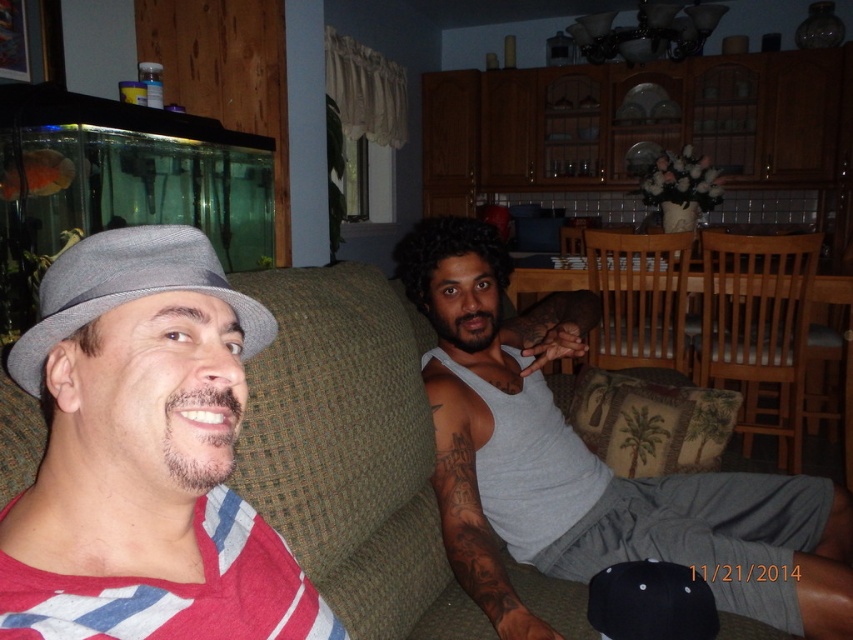
You are standing in the living room and want to place a small potted plant between the two points marked as point (x=115, y=317) and point (x=22, y=188). According to the scene, which point should the plant be closer to in order to be positioned in front of both?

The plant should be closer to point (x=22, y=188) because point (x=115, y=317) is in front of point (x=22, y=188), so placing it near the back point would still keep it in front of both.